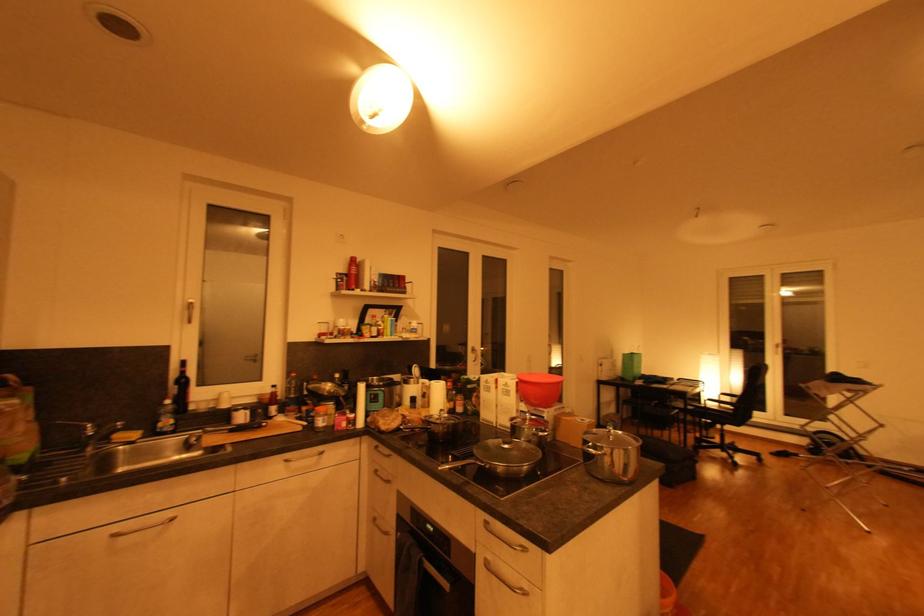
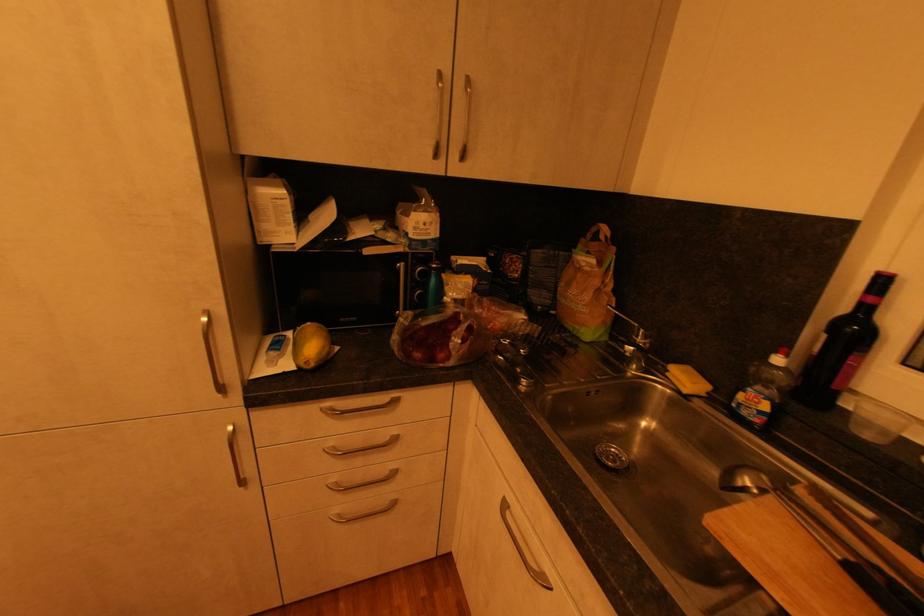
Find the pixel in the second image that matches pixel 27 400 in the first image.

(604, 264)